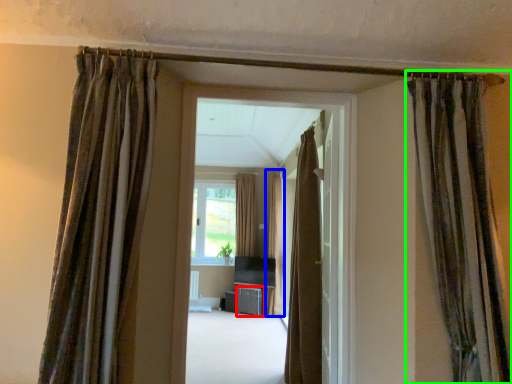
Question: Based on their relative distances, which object is farther from furniture (highlighted by a red box)? Choose from curtain (highlighted by a blue box) and curtain (highlighted by a green box).

Choices:
 (A) curtain
 (B) curtain

Answer: (B)